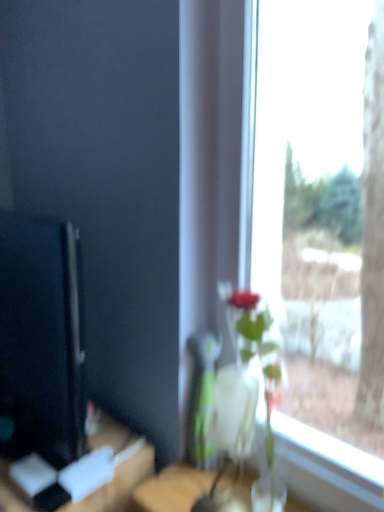
Question: From the image's perspective, does wooden table at lower left appear higher than black glossy computer monitor at left?

Choices:
 (A) no
 (B) yes

Answer: (A)

Question: Could you tell me if wooden table at lower left is turned towards black glossy computer monitor at left?

Choices:
 (A) no
 (B) yes

Answer: (A)

Question: Is the position of wooden table at lower left less distant than that of black glossy computer monitor at left?

Choices:
 (A) no
 (B) yes

Answer: (A)

Question: Is wooden table at lower left turned away from black glossy computer monitor at left?

Choices:
 (A) no
 (B) yes

Answer: (A)

Question: From a real-world perspective, is wooden table at lower left physically below black glossy computer monitor at left?

Choices:
 (A) yes
 (B) no

Answer: (A)

Question: In the image, is clear glass vase at center on the left side or the right side of wooden table at lower left?

Choices:
 (A) left
 (B) right

Answer: (B)

Question: Is clear glass vase at center wider or thinner than wooden table at lower left?

Choices:
 (A) thin
 (B) wide

Answer: (A)

Question: From a real-world perspective, is clear glass vase at center above or below wooden table at lower left?

Choices:
 (A) below
 (B) above

Answer: (B)

Question: Choose the correct answer: Is clear glass vase at center inside wooden table at lower left or outside it?

Choices:
 (A) inside
 (B) outside

Answer: (B)

Question: Is black glossy computer monitor at left taller or shorter than clear glass vase at center?

Choices:
 (A) short
 (B) tall

Answer: (B)

Question: Considering the positions of black glossy computer monitor at left and clear glass vase at center in the image, is black glossy computer monitor at left wider or thinner than clear glass vase at center?

Choices:
 (A) wide
 (B) thin

Answer: (A)

Question: Considering the relative positions of black glossy computer monitor at left and clear glass vase at center in the image provided, is black glossy computer monitor at left to the left or to the right of clear glass vase at center?

Choices:
 (A) right
 (B) left

Answer: (B)

Question: Considering the positions of black glossy computer monitor at left and clear glass vase at center in the image, is black glossy computer monitor at left bigger or smaller than clear glass vase at center?

Choices:
 (A) big
 (B) small

Answer: (A)

Question: From the image's perspective, relative to clear glass vase at center, is transparent glass vase at center above or below?

Choices:
 (A) below
 (B) above

Answer: (B)

Question: In the image, is transparent glass vase at center on the left side or the right side of clear glass vase at center?

Choices:
 (A) left
 (B) right

Answer: (B)